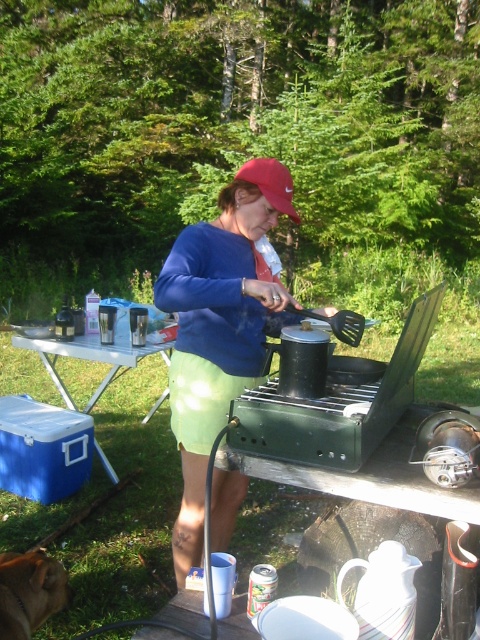
You are a hiker who just arrived at the campsite. You need to place your backpack on the surface that is higher between the white plastic picnic table at lower left and the red matte baseball cap at center. Which surface should you choose?

The red matte baseball cap at center is higher than the white plastic picnic table at lower left, so you should place your backpack on the red matte baseball cap at center.

You are standing at the camera position and want to place a 2.5 meter long tent on the ground. Can the white plastic picnic table at lower left be placed on the tent without overlapping?

The white plastic picnic table at lower left is 3.01 meters away from the camera. Since the tent is 2.5 meters long, the distance between the camera and the table is greater than the tent length, so placing the table on the tent would require moving it closer. Therefore, the table cannot be placed on the tent without overlapping as it is currently positioned 3.01 meters away from the camera.